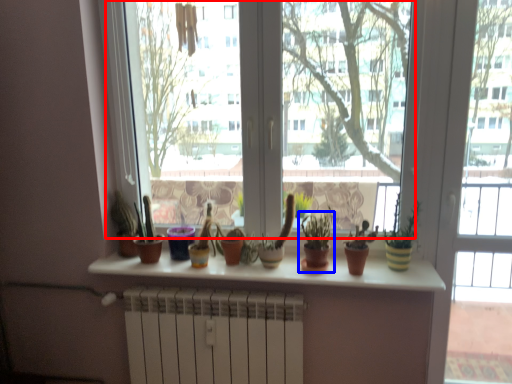
Question: Among these objects, which one is nearest to the camera, window screen (highlighted by a red box) or houseplant (highlighted by a blue box)?

Choices:
 (A) window screen
 (B) houseplant

Answer: (A)